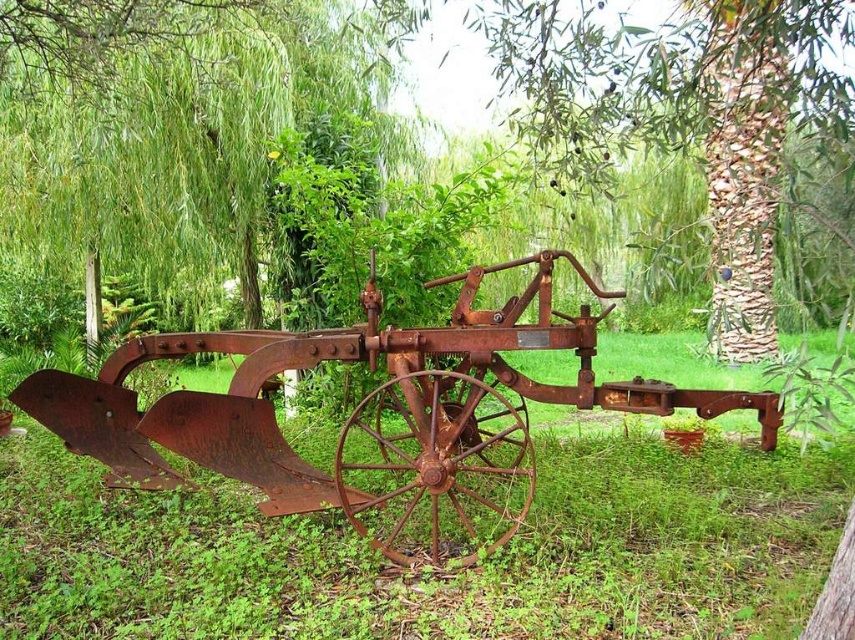
Question: Which object appears farthest from the camera in this image?

Choices:
 (A) rusty metal tree at center
 (B) rusty metal tractor at center

Answer: (B)

Question: Can you confirm if rusty metal tractor at center is positioned below rusty metal tree at center?

Choices:
 (A) yes
 (B) no

Answer: (A)

Question: Which point is closer to the camera taking this photo?

Choices:
 (A) (458, 365)
 (B) (410, 22)

Answer: (A)

Question: Which object appears farthest from the camera in this image?

Choices:
 (A) rusty metal tree at center
 (B) rusty metal tractor at center

Answer: (B)

Question: Is the position of rusty metal tractor at center more distant than that of rusty metal tree at center?

Choices:
 (A) yes
 (B) no

Answer: (A)

Question: Is rusty metal tractor at center bigger than rusty metal tree at center?

Choices:
 (A) yes
 (B) no

Answer: (B)